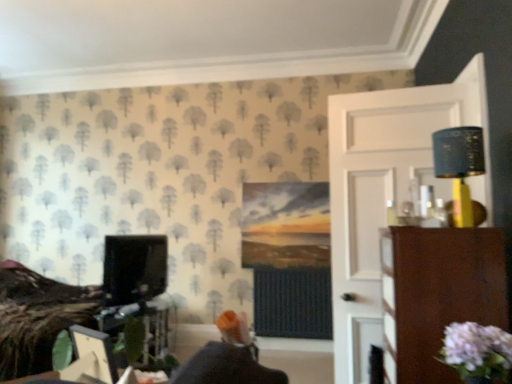
Question: Would you say matte black monitor at left contains pale pink fabric flower at lower right?

Choices:
 (A) yes
 (B) no

Answer: (B)

Question: From the image's perspective, is matte black monitor at left beneath pale pink fabric flower at lower right?

Choices:
 (A) no
 (B) yes

Answer: (B)

Question: Does matte black monitor at left touch pale pink fabric flower at lower right?

Choices:
 (A) yes
 (B) no

Answer: (B)

Question: Is matte black monitor at left positioned behind pale pink fabric flower at lower right?

Choices:
 (A) no
 (B) yes

Answer: (B)

Question: Is matte black monitor at left bigger than pale pink fabric flower at lower right?

Choices:
 (A) yes
 (B) no

Answer: (A)

Question: Is matte black monitor at left to the right of pale pink fabric flower at lower right from the viewer's perspective?

Choices:
 (A) no
 (B) yes

Answer: (A)

Question: Would you consider matte black lampshade at upper right to be distant from pale pink fabric flower at lower right?

Choices:
 (A) yes
 (B) no

Answer: (B)

Question: From a real-world perspective, is matte black lampshade at upper right physically above pale pink fabric flower at lower right?

Choices:
 (A) no
 (B) yes

Answer: (B)

Question: Considering the relative sizes of matte black lampshade at upper right and pale pink fabric flower at lower right in the image provided, is matte black lampshade at upper right taller than pale pink fabric flower at lower right?

Choices:
 (A) yes
 (B) no

Answer: (A)

Question: Is matte black lampshade at upper right shorter than pale pink fabric flower at lower right?

Choices:
 (A) no
 (B) yes

Answer: (A)

Question: From a real-world perspective, does matte black lampshade at upper right sit lower than pale pink fabric flower at lower right?

Choices:
 (A) no
 (B) yes

Answer: (A)

Question: Could you tell me if matte black lampshade at upper right is turned towards pale pink fabric flower at lower right?

Choices:
 (A) yes
 (B) no

Answer: (B)

Question: Can you confirm if brown wood dresser at right is positioned to the right of matte black lampshade at upper right?

Choices:
 (A) yes
 (B) no

Answer: (B)